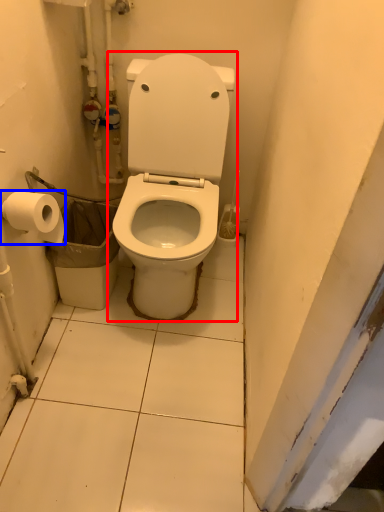
Question: Among these objects, which one is farthest to the camera, toilet (highlighted by a red box) or toilet paper (highlighted by a blue box)?

Choices:
 (A) toilet
 (B) toilet paper

Answer: (B)